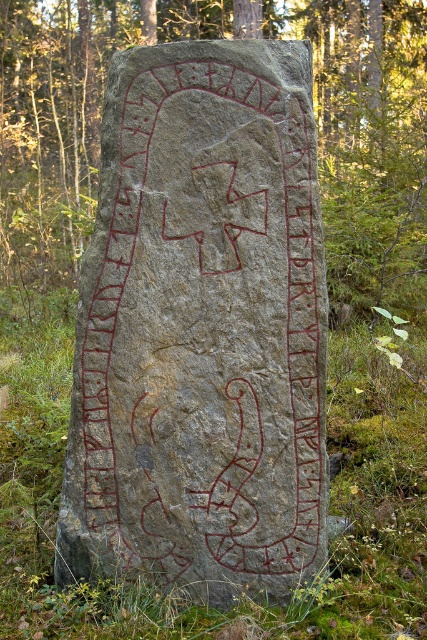
Question: Does gray stone at center appear on the left side of gray stone carving at center?

Choices:
 (A) no
 (B) yes

Answer: (B)

Question: From the image, what is the correct spatial relationship of gray stone at center in relation to gray stone carving at center?

Choices:
 (A) above
 (B) below

Answer: (B)

Question: Does gray stone at center have a smaller size compared to gray stone carving at center?

Choices:
 (A) yes
 (B) no

Answer: (A)

Question: Which point is closer to the camera taking this photo?

Choices:
 (A) (312, 164)
 (B) (78, 177)

Answer: (A)